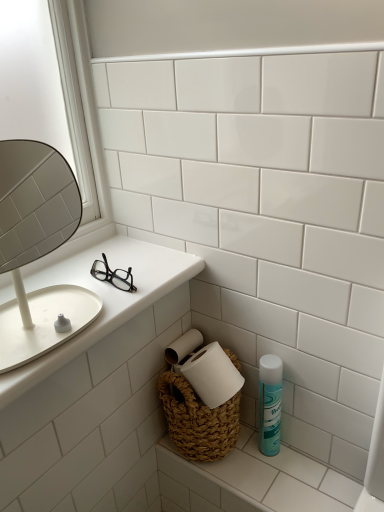
Locate an element on the screen. This screenshot has height=512, width=384. free spot above white glossy counter top at left, the 2th counter top in the right-to-left sequence (from a real-world perspective) is located at coordinates (86, 284).